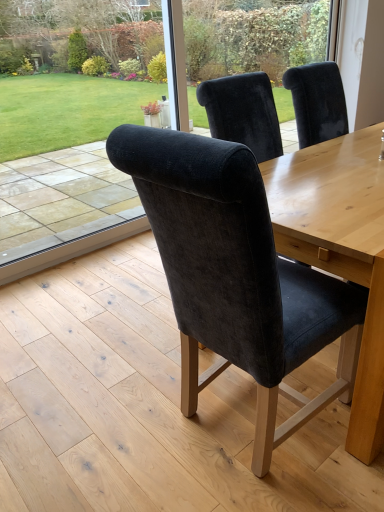
The image size is (384, 512). What are the coordinates of `vacant space in velvet dark blue chair at center (from a real-world perspective)` in the screenshot? It's located at (224, 426).